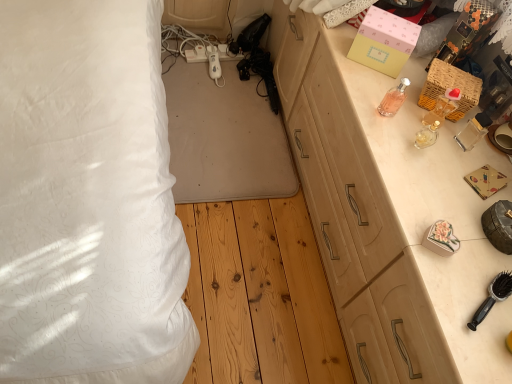
Image resolution: width=512 pixels, height=384 pixels. Identify the location of free region on the left part of black plastic brush at lower right. (434, 274).